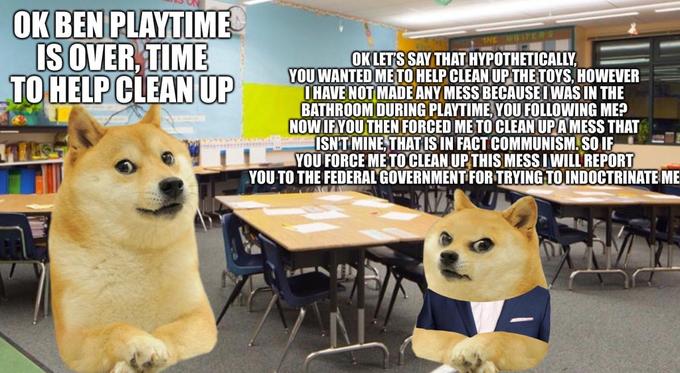
Find the location of a particular element. window is located at coordinates (670, 89).